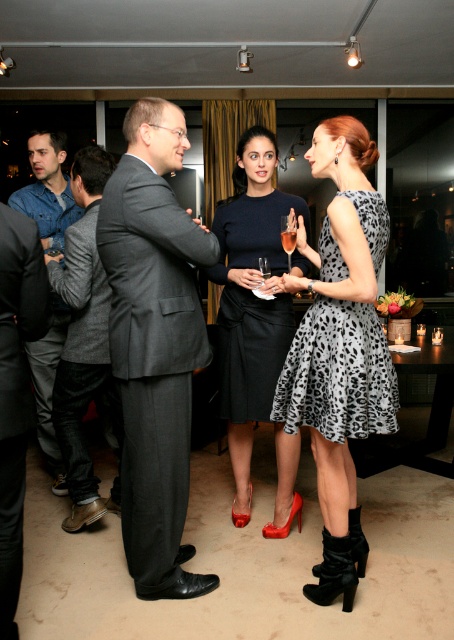
Question: Can you confirm if gray pinstripe suit at center is thinner than clear glass wine glass at center?

Choices:
 (A) no
 (B) yes

Answer: (A)

Question: Where is leopard print dress at center located in relation to clear glass wine glass at center in the image?

Choices:
 (A) right
 (B) left

Answer: (A)

Question: Which point is closer to the camera?

Choices:
 (A) (84, 148)
 (B) (284, 243)

Answer: (B)

Question: Which point is farther to the camera?

Choices:
 (A) [355, 196]
 (B) [287, 272]
 (C) [263, 257]

Answer: (C)

Question: Is gray pinstripe suit at center positioned before gray wool suit at center?

Choices:
 (A) yes
 (B) no

Answer: (A)

Question: Which object is closer to the camera taking this photo?

Choices:
 (A) gray pinstripe suit at center
 (B) clear glass wine glass at center
 (C) matte black dress at center

Answer: (A)